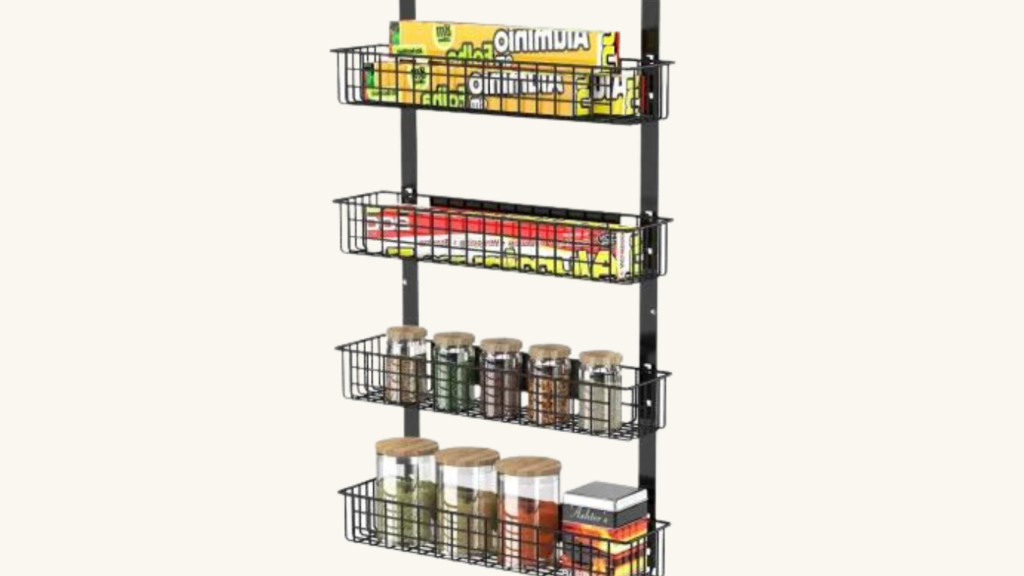
In order to click on hanging pantry shelf organizer in this screenshot , I will do `click(649, 28)`.